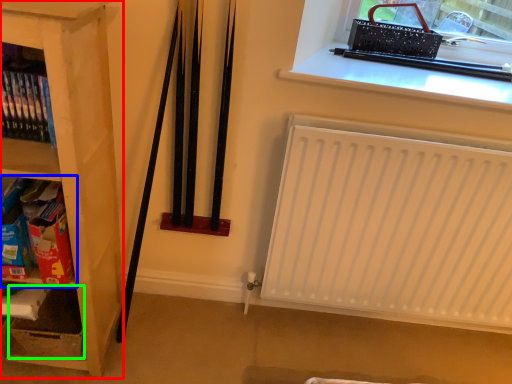
Question: Considering the real-world distances, which object is farthest from shelf (highlighted by a red box)? shelf (highlighted by a blue box) or storage box (highlighted by a green box)?

Choices:
 (A) shelf
 (B) storage box

Answer: (B)